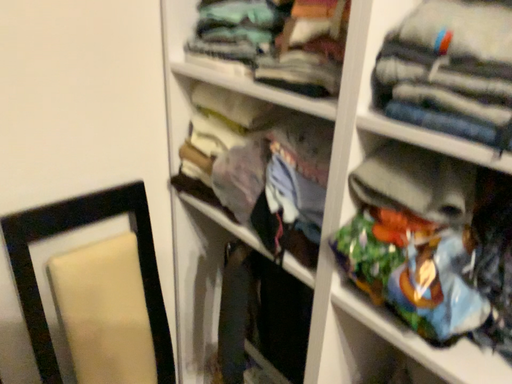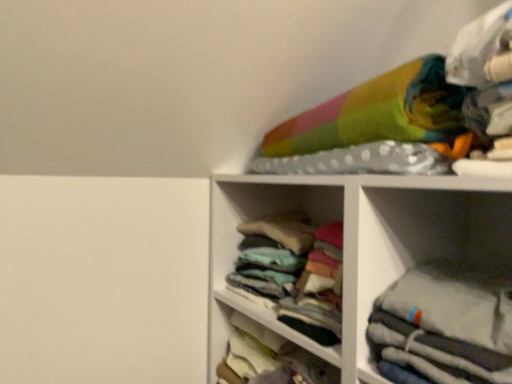
Question: Which way did the camera rotate in the video?

Choices:
 (A) rotated downward
 (B) rotated upward

Answer: (B)